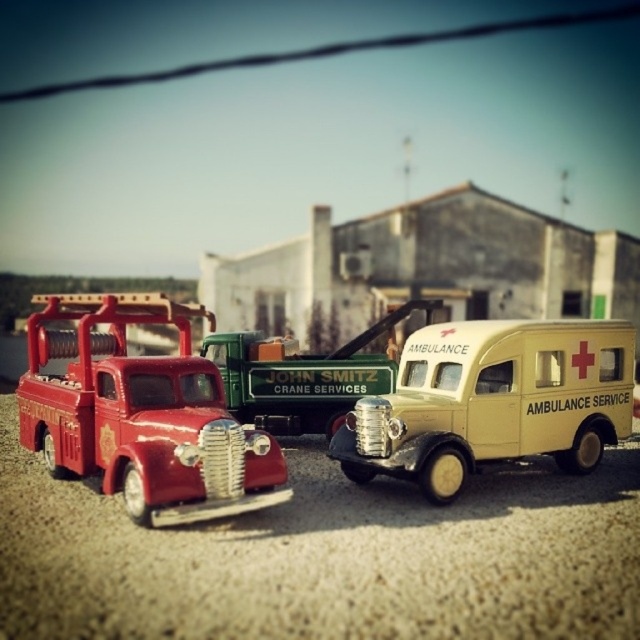
From the picture: You are a child trying to decide which toy truck to play with first. You want to choose the larger one between the matte red truck at left and the green matte truck at center. Which one should you pick?

The matte red truck at left is bigger than the green matte truck at center, so you should pick the matte red truck at left.

You are a child trying to decide which toy vehicle to play with first. You want to choose the larger one between the matte red truck at left and the beige matte ambulance service vehicle at center. Which one should you pick?

The matte red truck at left is bigger than the beige matte ambulance service vehicle at center, so you should pick the matte red truck at left.

You are a delivery person who needs to load a box onto a truck. The box requires a minimum clearance of 23 inches between the two trucks to be safely placed. Based on the scene, can you fit the box between the matte red truck at left and the green matte truck at center?

The matte red truck at left is 22.79 inches away from the green matte truck at center, which is less than the required 23 inches clearance. Therefore, the box cannot be safely placed between them.